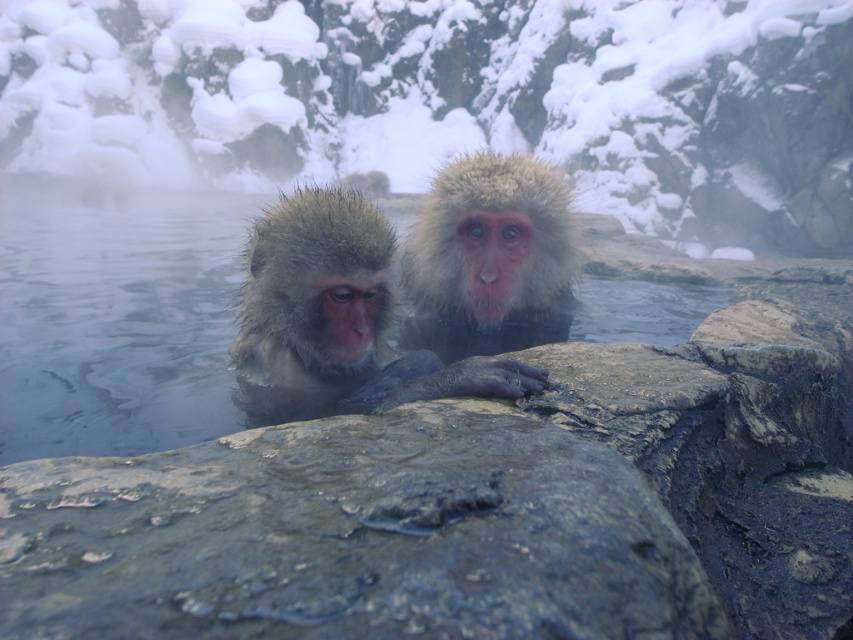
Question: Which point is closer to the camera?

Choices:
 (A) fuzzy fur monkey at center
 (B) fuzzy white fur monkey at center

Answer: (A)

Question: Can you confirm if fuzzy fur monkey at center is thinner than fuzzy white fur monkey at center?

Choices:
 (A) yes
 (B) no

Answer: (A)

Question: Which point is closer to the camera?

Choices:
 (A) (328, 339)
 (B) (550, 214)

Answer: (A)

Question: Can you confirm if fuzzy fur monkey at center is positioned above fuzzy white fur monkey at center?

Choices:
 (A) no
 (B) yes

Answer: (A)

Question: Does fuzzy fur monkey at center appear under fuzzy white fur monkey at center?

Choices:
 (A) no
 (B) yes

Answer: (B)

Question: Which point is farther to the camera?

Choices:
 (A) fuzzy fur monkey at center
 (B) fuzzy white fur monkey at center

Answer: (B)